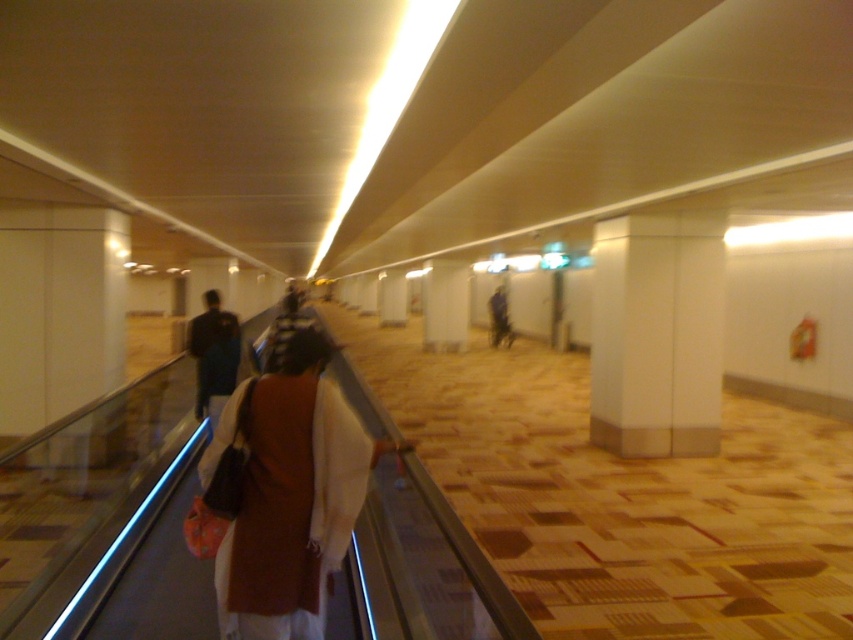
Which is more to the right, dark blue jacket at left or dark blue jacket at center?

Positioned to the right is dark blue jacket at center.

Between dark blue jacket at left and dark blue jacket at center, which one is positioned lower?

dark blue jacket at left is lower down.

Is point (207, 369) farther from camera compared to point (496, 289)?

No.

Locate an element on the screen. dark blue jacket at left is located at coordinates (213, 353).

Does brown fabric bag at center have a lesser width compared to dark blue jacket at left?

No.

Locate an element on the screen. The image size is (853, 640). brown fabric bag at center is located at coordinates (289, 493).

The width and height of the screenshot is (853, 640). Describe the element at coordinates (289, 493) in the screenshot. I see `brown fabric bag at center` at that location.

Can you confirm if brown fabric bag at center is positioned to the right of dark blue jacket at center?

In fact, brown fabric bag at center is to the left of dark blue jacket at center.

Is point (289, 352) positioned before point (495, 296)?

That is True.

You are a GUI agent. You are given a task and a screenshot of the screen. Output one action in this format:
    pyautogui.click(x=<x>, y=<y>)
    Task: Click on the brown fabric bag at center
    
    Given the screenshot: What is the action you would take?
    pyautogui.click(x=289, y=493)